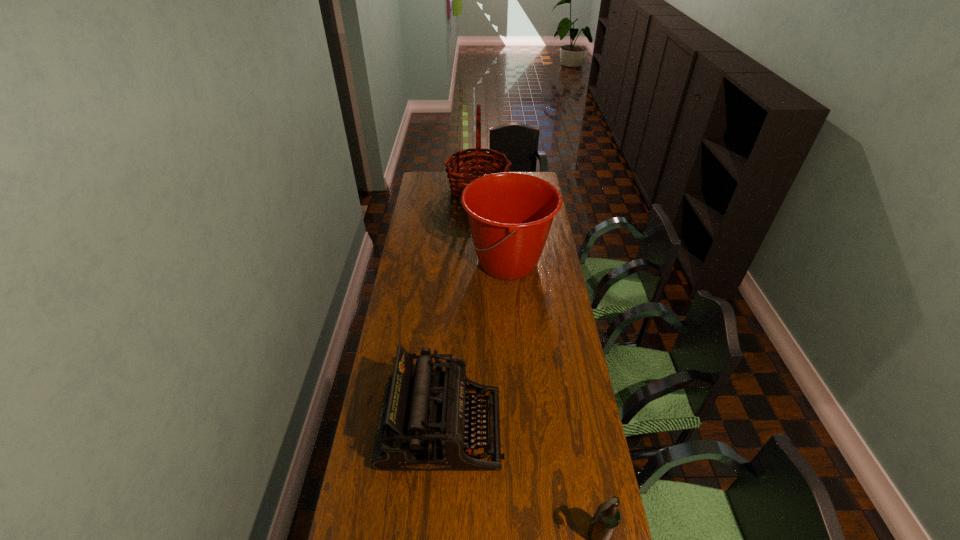
Where is `object situated at the far edge`? Image resolution: width=960 pixels, height=540 pixels. object situated at the far edge is located at coordinates [x=474, y=162].

Locate an element on the screen. object that is at the left edge is located at coordinates (421, 427).

Identify the location of object that is positioned at the right edge. (510, 214).

The image size is (960, 540). I want to click on free space at the left edge of the desktop, so click(416, 220).

The image size is (960, 540). In order to click on free space at the right edge of the desktop in this screenshot , I will do `click(544, 275)`.

Find the location of a particular element. The image size is (960, 540). vacant space at the far left corner of the desktop is located at coordinates (436, 178).

At what (x,y) coordinates should I click in order to perform the action: click on empty space between the typewriter and the third nearest object. Please return your answer as a coordinate pair (x, y). The width and height of the screenshot is (960, 540). Looking at the image, I should click on (475, 345).

Where is `object identified as the closest to the beer bottle`? The image size is (960, 540). object identified as the closest to the beer bottle is located at coordinates (421, 427).

Where is `object that is the third closest to the farthest object`? The height and width of the screenshot is (540, 960). object that is the third closest to the farthest object is located at coordinates (606, 519).

Identify the location of free spot that satisfies the following two spatial constraints: 1. on the front side of the farthest object; 2. on the keyboard of the typewriter. (476, 428).